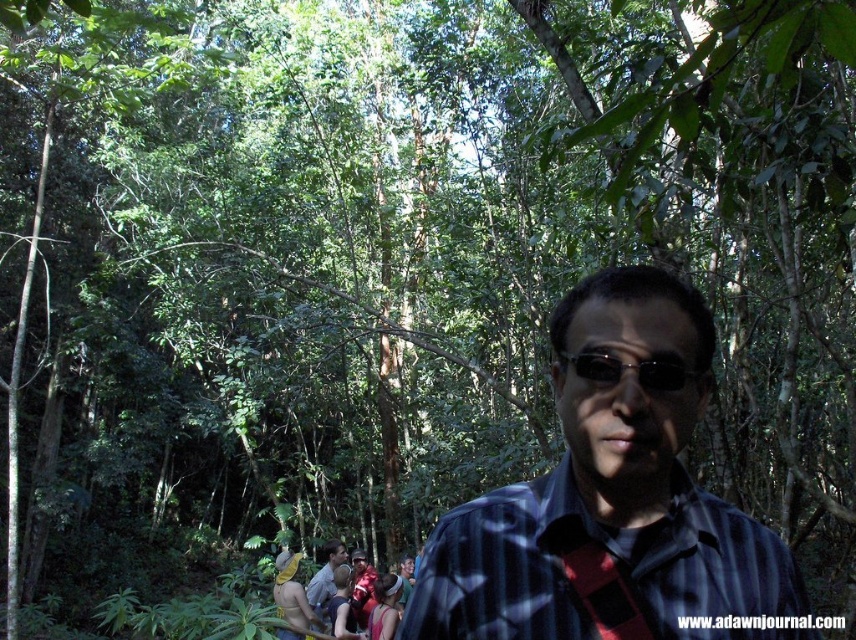
Question: Is blue striped shirt at center thinner than red fabric tie at center?

Choices:
 (A) yes
 (B) no

Answer: (B)

Question: Which point is closer to the camera?

Choices:
 (A) red fabric tie at center
 (B) blue striped shirt at center
 (C) matte blue shirt at lower center
 (D) black plastic sunglasses at center

Answer: (B)

Question: Estimate the real-world distances between objects in this image. Which object is closer to the matte blue shirt at lower center?

Choices:
 (A) blue striped shirt at center
 (B) red fabric tie at center
 (C) black plastic sunglasses at center

Answer: (A)

Question: Which object appears farthest from the camera in this image?

Choices:
 (A) red fabric tie at center
 (B) matte blue shirt at lower center
 (C) blue striped shirt at center

Answer: (B)

Question: Is blue striped shirt at center above black plastic sunglasses at center?

Choices:
 (A) no
 (B) yes

Answer: (A)

Question: Can you confirm if blue striped shirt at center is smaller than black plastic sunglasses at center?

Choices:
 (A) yes
 (B) no

Answer: (B)